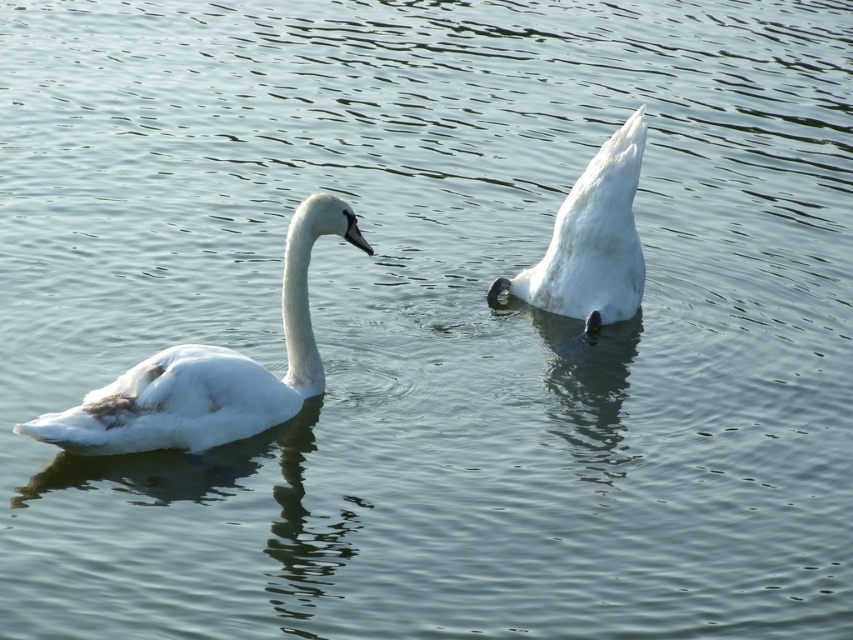
This screenshot has width=853, height=640. I want to click on white matte swan at left, so click(209, 371).

Between white matte swan at left and white matte swan at center, which one is positioned lower?

white matte swan at left is lower down.

Find the location of a particular element. Image resolution: width=853 pixels, height=640 pixels. white matte swan at left is located at coordinates (209, 371).

Where is `white matte swan at left`? This screenshot has width=853, height=640. white matte swan at left is located at coordinates (209, 371).